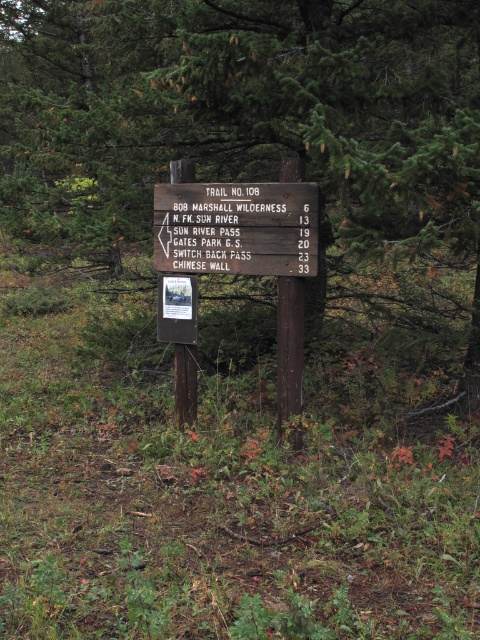
Can you confirm if brown wooden sign at center is bigger than wooden sign at center?

Yes.

You are a GUI agent. You are given a task and a screenshot of the screen. Output one action in this format:
    pyautogui.click(x=<x>, y=<y>)
    Task: Click on the brown wooden sign at center
    Image resolution: width=480 pixels, height=640 pixels.
    Given the screenshot: What is the action you would take?
    pyautogui.click(x=247, y=248)

Can you confirm if green pine tree at center is positioned below wooden sign at center?

No, green pine tree at center is not below wooden sign at center.

Is point (113, 38) farther from camera compared to point (252, 224)?

Yes, point (113, 38) is behind point (252, 224).

Find the location of a particular element. The width and height of the screenshot is (480, 640). green pine tree at center is located at coordinates (247, 118).

Is point (313, 141) positioned behind point (193, 397)?

No, (313, 141) is closer to viewer.

Who is more forward, [344,100] or [222,237]?

Point [222,237] is more forward.

Find the location of a particular element. green pine tree at center is located at coordinates (247, 118).